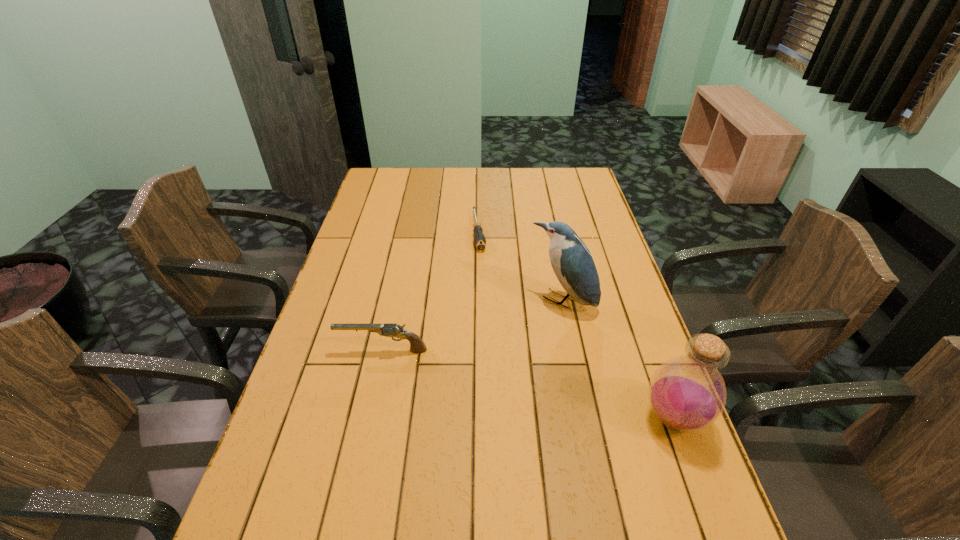
I want to click on free space located 0.170m at the tip of the second farthest object's beak, so click(516, 354).

Locate an element on the screen. The height and width of the screenshot is (540, 960). free space located at the tip of the second farthest object's beak is located at coordinates (531, 335).

Image resolution: width=960 pixels, height=540 pixels. What are the coordinates of `vacant space located 0.100m at the tip of the second farthest object's beak` in the screenshot? It's located at (529, 337).

The width and height of the screenshot is (960, 540). In order to click on blank area located 0.220m at the tip of the farthest object in this screenshot , I will do `click(488, 298)`.

Where is `free spot located 0.140m at the tip of the farthest object`? This screenshot has width=960, height=540. free spot located 0.140m at the tip of the farthest object is located at coordinates [485, 280].

You are a GUI agent. You are given a task and a screenshot of the screen. Output one action in this format:
    pyautogui.click(x=<x>, y=<y>)
    Task: Click on the free space located at the tip of the farthest object
    Image resolution: width=960 pixels, height=540 pixels.
    Given the screenshot: What is the action you would take?
    [483, 270]

Locate an element on the screen. object that is at the left edge is located at coordinates click(417, 345).

The width and height of the screenshot is (960, 540). In order to click on bottle that is at the right edge in this screenshot , I will do `click(687, 393)`.

Identify the location of bird that is positioned at the right edge. (571, 260).

Where is `free space at the far edge`? Image resolution: width=960 pixels, height=540 pixels. free space at the far edge is located at coordinates (543, 193).